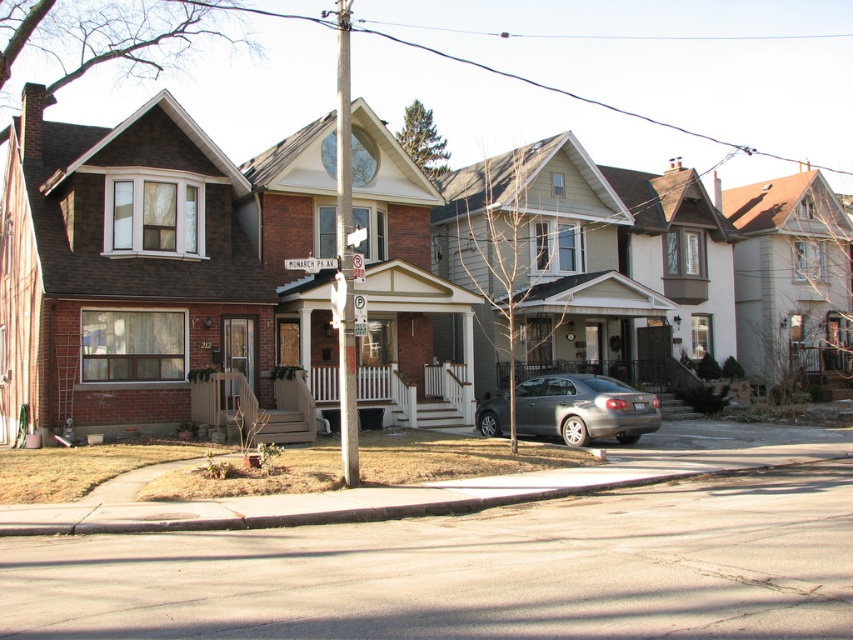
Question: Is brown asphalt curb at lower center wider than satin silver sedan at center?

Choices:
 (A) yes
 (B) no

Answer: (A)

Question: Can you confirm if brown asphalt curb at lower center is positioned to the right of satin silver sedan at center?

Choices:
 (A) yes
 (B) no

Answer: (B)

Question: Which of the following is the farthest from the observer?

Choices:
 (A) (525, 388)
 (B) (567, 493)
 (C) (335, 264)

Answer: (A)

Question: Based on their relative distances, which object is farther from the satin silver sedan at center?

Choices:
 (A) wooden street sign at center
 (B) brown asphalt curb at lower center

Answer: (A)

Question: Which point is closer to the camera?

Choices:
 (A) (461, 492)
 (B) (315, 259)
 (C) (631, 410)

Answer: (A)

Question: Where is brown asphalt curb at lower center located in relation to satin silver sedan at center in the image?

Choices:
 (A) left
 (B) right

Answer: (A)